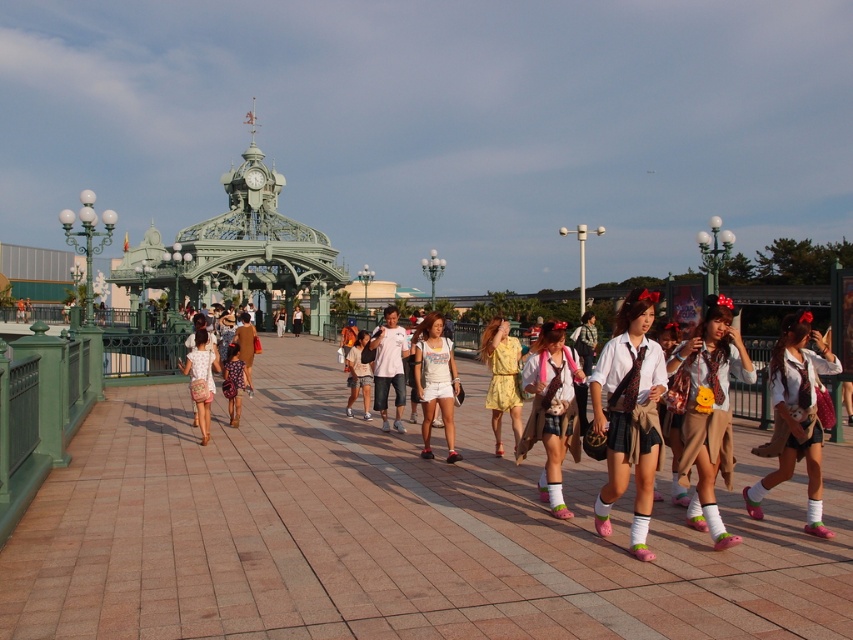
Question: Does matte white blouse at center appear under dotted fabric skirt at center?

Choices:
 (A) no
 (B) yes

Answer: (B)

Question: Is matte pink coat at center positioned in front of dotted fabric skirt at center?

Choices:
 (A) yes
 (B) no

Answer: (A)

Question: Among these objects, which one is nearest to the camera?

Choices:
 (A) matte floral dress at center
 (B) paved brick walkway at center

Answer: (B)

Question: Is matte beige skirt at center positioned at the back of white cotton dress at center?

Choices:
 (A) no
 (B) yes

Answer: (A)

Question: Which point is closer to the camera?

Choices:
 (A) (x=230, y=397)
 (B) (x=352, y=378)
 (C) (x=682, y=364)

Answer: (C)

Question: Which point is closer to the camera?

Choices:
 (A) (202, 353)
 (B) (426, 408)
 (C) (529, 365)
 (D) (486, 326)

Answer: (C)